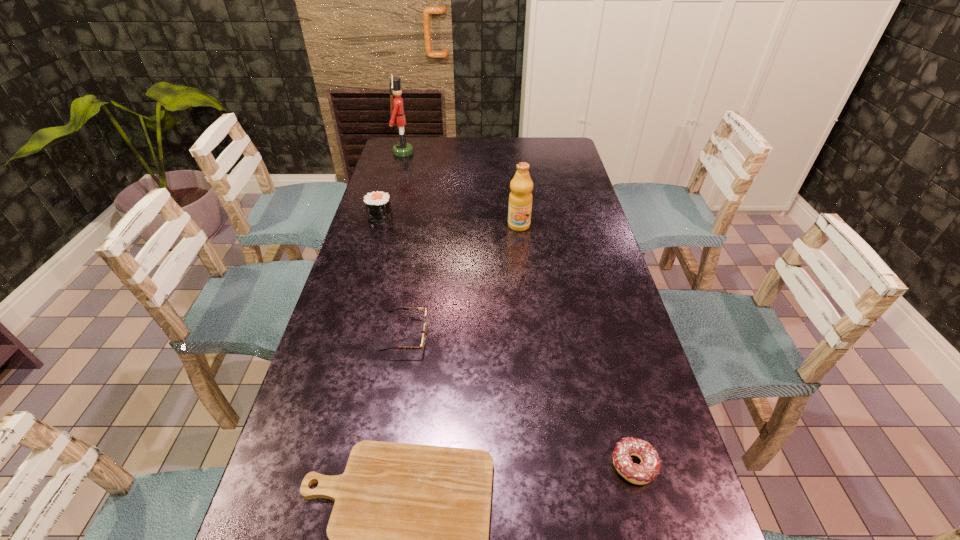
You are a GUI agent. You are given a task and a screenshot of the screen. Output one action in this format:
    pyautogui.click(x=<x>, y=<y>)
    Task: Click on the free space between the rightmost object and the fruit juice
    
    Given the screenshot: What is the action you would take?
    pyautogui.click(x=576, y=345)

Locate an element on the screen. Image resolution: width=960 pixels, height=540 pixels. blank region between the doughnut and the fifth shortest object is located at coordinates (576, 345).

The image size is (960, 540). I want to click on free point between the spectacles and the tallest object, so click(404, 245).

Locate which object is the fifth closest to the rightmost object. Please provide its 2D coordinates. Your answer should be formatted as a tuple, i.e. [(x, y)], where the tuple contains the x and y coordinates of a point satisfying the conditions above.

[(402, 149)]

Find the location of a particular element. the fifth closest object to the rightmost object is located at coordinates (402, 149).

I want to click on free region that satisfies the following two spatial constraints: 1. on the front-facing side of the nutcracker; 2. on the front side of the fourth shortest object, so click(385, 217).

You are a GUI agent. You are given a task and a screenshot of the screen. Output one action in this format:
    pyautogui.click(x=<x>, y=<y>)
    Task: Click on the free space that satisfies the following two spatial constraints: 1. on the front side of the sushi; 2. on the right side of the doughnut
    This screenshot has height=540, width=960.
    Given the screenshot: What is the action you would take?
    (x=306, y=465)

In order to click on free location that satisfies the following two spatial constraints: 1. on the front-facing side of the tallest object; 2. on the left side of the doughnut in this screenshot , I will do `click(316, 465)`.